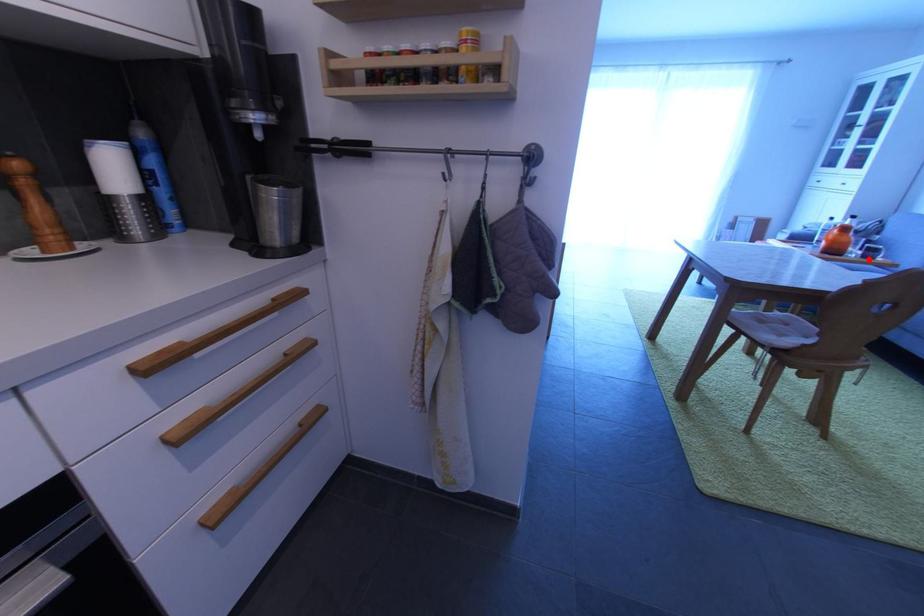
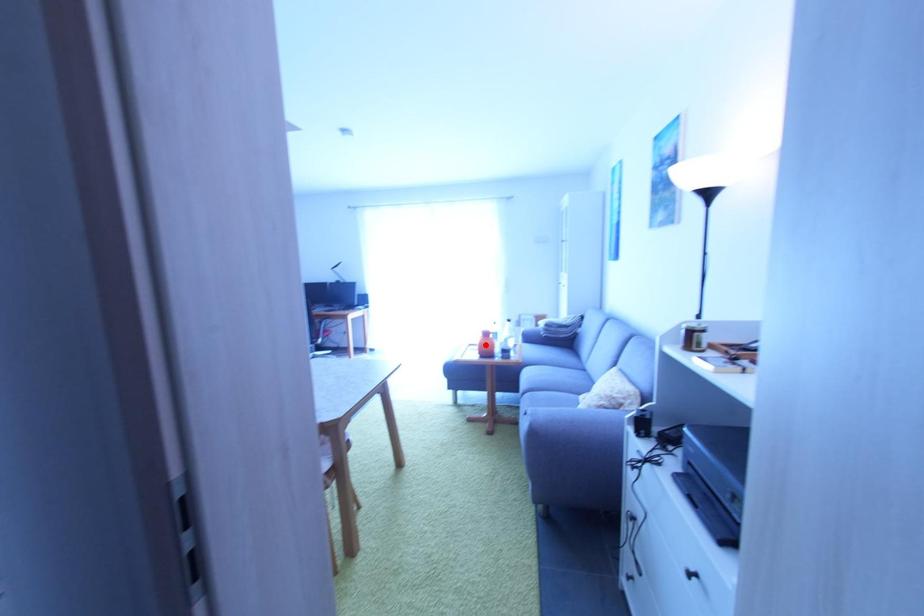
I am providing you with two images of the same scene from different viewpoints. A red point is marked on the first image and another point is marked on the second image. Is the marked point in image1 the same physical position as the marked point in image2?

No